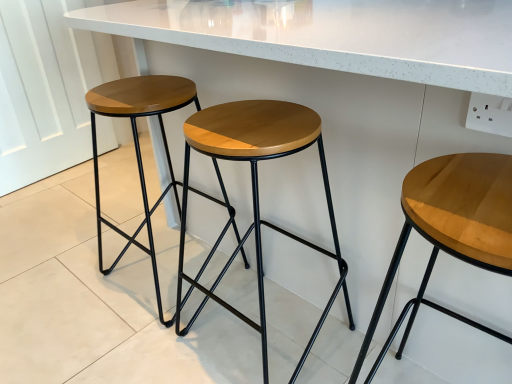
You are a GUI agent. You are given a task and a screenshot of the screen. Output one action in this format:
    pyautogui.click(x=<x>, y=<y>)
    Task: Click on the free region on the left part of wooden seat at center, placed as the 3th stool when sorted from right to left
    Image resolution: width=512 pixels, height=384 pixels.
    Given the screenshot: What is the action you would take?
    pyautogui.click(x=78, y=293)